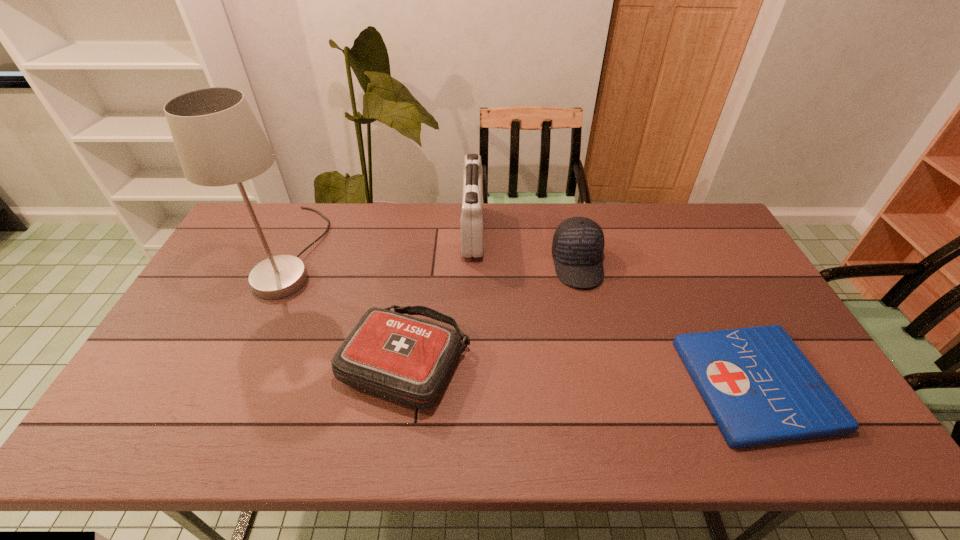
I want to click on vacant point located 0.300m on the front side of the tallest first-aid kit, so click(569, 233).

In order to click on vacant space positioned at the front of the baseball cap where the brim is located in this screenshot , I will do `click(607, 389)`.

At what (x,y) coordinates should I click in order to perform the action: click on free space located on the back of the second shortest object. Please return your answer as a coordinate pair (x, y). The height and width of the screenshot is (540, 960). Looking at the image, I should click on pyautogui.click(x=421, y=252).

You are a GUI agent. You are given a task and a screenshot of the screen. Output one action in this format:
    pyautogui.click(x=<x>, y=<y>)
    Task: Click on the free space located 0.240m on the left of the shortest object
    
    Given the screenshot: What is the action you would take?
    pyautogui.click(x=591, y=384)

Identify the location of table lamp that is at the far edge. (219, 142).

Where is `the first-aid kit that is at the far edge`? the first-aid kit that is at the far edge is located at coordinates (472, 218).

The image size is (960, 540). What are the coordinates of `baseball cap located at the far edge` in the screenshot? It's located at (578, 243).

At what (x,y) coordinates should I click in order to perform the action: click on object at the left edge. Please return your answer as a coordinate pair (x, y). The width and height of the screenshot is (960, 540). Looking at the image, I should click on (219, 142).

The image size is (960, 540). I want to click on object located in the right edge section of the desktop, so click(x=759, y=387).

Where is `object at the far left corner`? Image resolution: width=960 pixels, height=540 pixels. object at the far left corner is located at coordinates (219, 142).